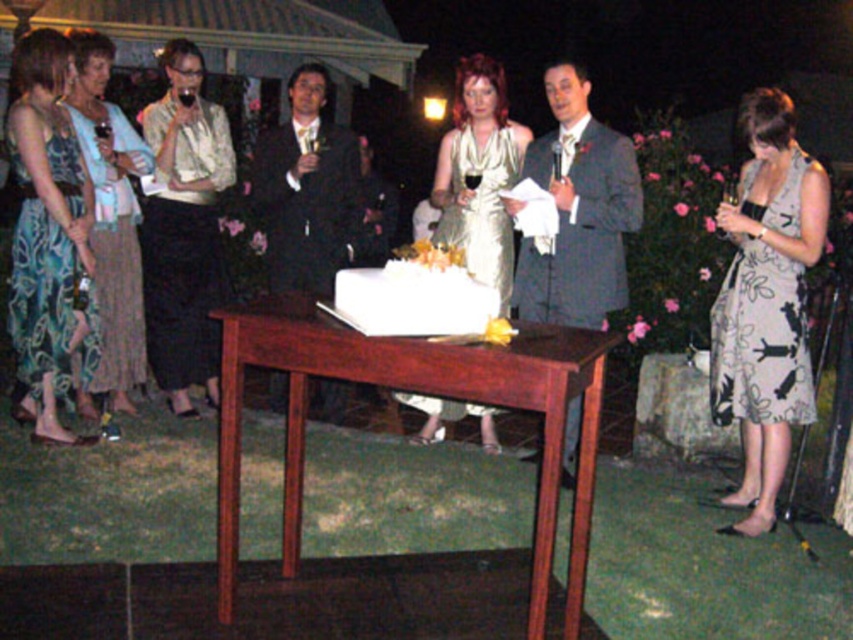
Question: Which of the following is the closest to the observer?

Choices:
 (A) blue floral dress at left
 (B) satin gold dress at center
 (C) white frosted cake at center
 (D) teal floral dress at left

Answer: (C)

Question: Which point is closer to the camera?

Choices:
 (A) gray textured suit at center
 (B) shiny black suit at center

Answer: (A)

Question: In this image, where is gray textured suit at center located relative to teal floral dress at left?

Choices:
 (A) above
 (B) below

Answer: (A)

Question: Is mahogany wood table at center above satin gold dress at center?

Choices:
 (A) yes
 (B) no

Answer: (B)

Question: Which is nearer to the shiny gold dress at center?

Choices:
 (A) white frosted cake at center
 (B) blue floral dress at left

Answer: (B)

Question: Does silky black suit at center have a smaller size compared to shiny black suit at center?

Choices:
 (A) no
 (B) yes

Answer: (A)